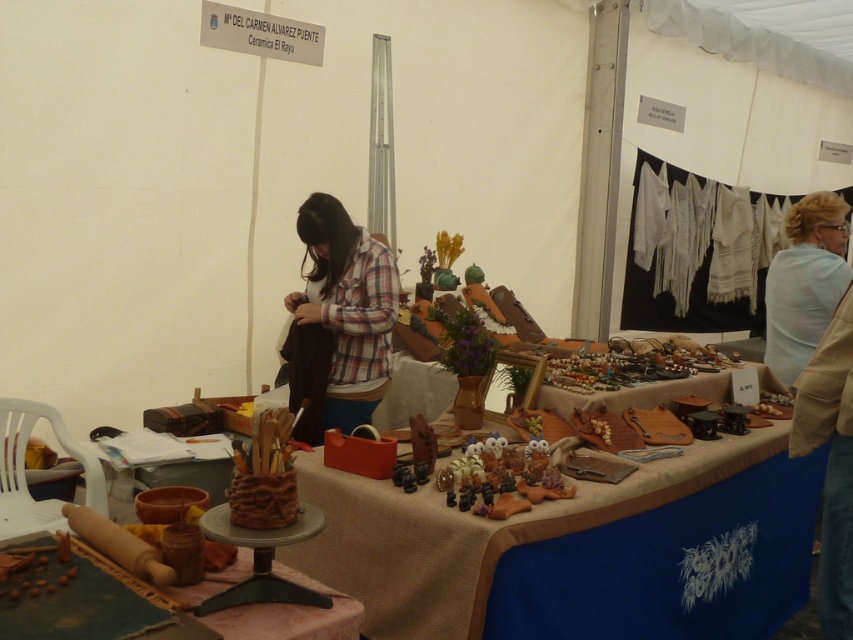
You are a customer at the craft fair and want to see the light blue fabric at upper right clearly. Is the plaid fabric shirt at center blocking your view of it?

The plaid fabric shirt at center is in front of the light blue fabric at upper right, so it is blocking the view of the light blue fabric at upper right.

You are a customer at the craft fair and want to know if the plaid fabric shirt at center is taller than the light blue fabric at upper right. Can you confirm this?

The plaid fabric shirt at center is taller than the light blue fabric at upper right, so yes, the plaid fabric shirt at center is taller than the light blue fabric at upper right.